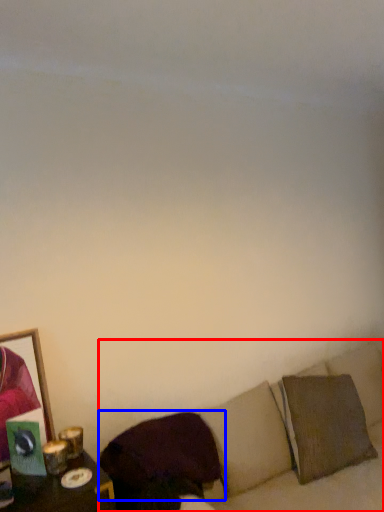
Question: Which object is further to the camera taking this photo, couch (highlighted by a red box) or pillow (highlighted by a blue box)?

Choices:
 (A) couch
 (B) pillow

Answer: (B)